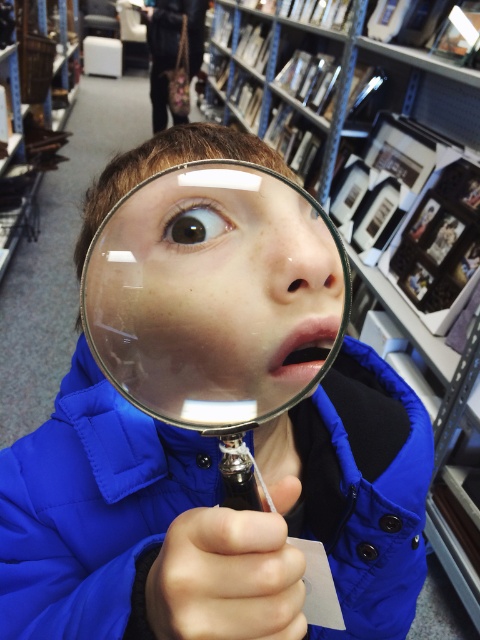
You are a photographer trying to capture a clear photo of the metallic silver bookshelf at upper center without the transparent glass magnifying glass at center blocking the view. Based on their positions, is it possible to take such a photo without moving either object?

The transparent glass magnifying glass at center is located below the metallic silver bookshelf at upper center, so it might be possible to angle the camera upwards to capture the bookshelf without the magnifying glass blocking the view.

You are a customer in a bookstore and see a child holding a magnifying glass. The magnifying glass is at point [132,531]. Is the magnifying glass on the blue matte jacket at center?

Yes, the magnifying glass is on the blue matte jacket at center because the point [132,531] is on the blue matte jacket at center.